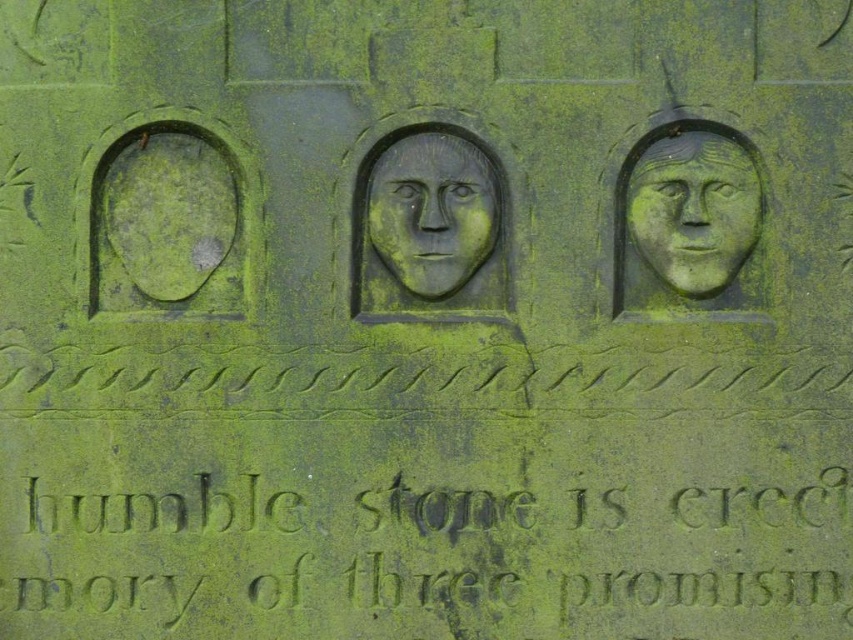
Question: Which point is closer to the camera?

Choices:
 (A) (659, 198)
 (B) (416, 259)
 (C) (795, 513)

Answer: (B)

Question: Among these points, which one is nearest to the camera?

Choices:
 (A) (456, 196)
 (B) (45, 608)
 (C) (699, 218)

Answer: (C)

Question: Which point is farther from the camera taking this photo?

Choices:
 (A) (664, 186)
 (B) (456, 257)

Answer: (B)

Question: Does green stone engraving at center have a lesser width compared to green stone carving at center?

Choices:
 (A) yes
 (B) no

Answer: (B)

Question: Can you confirm if green stone engraving at center is wider than green stone carving at center?

Choices:
 (A) no
 (B) yes

Answer: (B)

Question: Is green stone engraving at center to the left of gray stone face at center from the viewer's perspective?

Choices:
 (A) yes
 (B) no

Answer: (A)